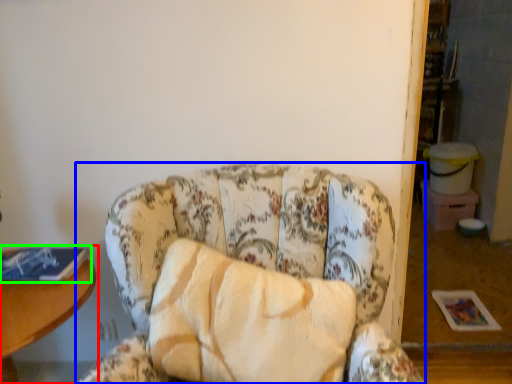
Question: Considering the real-world distances, which object is farthest from table (highlighted by a red box)? chair (highlighted by a blue box) or book (highlighted by a green box)?

Choices:
 (A) chair
 (B) book

Answer: (A)